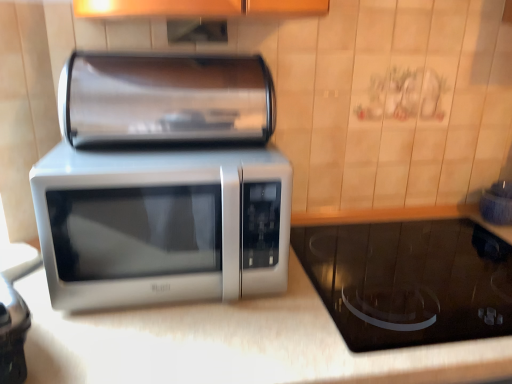
What do you see at coordinates (165, 99) in the screenshot?
I see `satin silver paper towel holder at upper center, placed as the second appliance when sorted from right to left` at bounding box center [165, 99].

What is the approximate height of black glass cooktop at lower right, which is the 1th appliance in right-to-left order?

black glass cooktop at lower right, which is the 1th appliance in right-to-left order, is 9.40 centimeters in height.

What is the approximate width of satin silver microwave at center?

satin silver microwave at center is 14.83 inches in width.

Locate an element on the screen. The image size is (512, 384). satin silver paper towel holder at upper center, placed as the second appliance when sorted from right to left is located at coordinates (165, 99).

Would you consider white glossy countertop at center to be distant from satin silver paper towel holder at upper center, positioned as the first appliance in left-to-right order?

No, white glossy countertop at center is in close proximity to satin silver paper towel holder at upper center, positioned as the first appliance in left-to-right order.

Does white glossy countertop at center have a smaller size compared to satin silver paper towel holder at upper center, positioned as the first appliance in left-to-right order?

No, white glossy countertop at center is not smaller than satin silver paper towel holder at upper center, positioned as the first appliance in left-to-right order.

Could you tell me if white glossy countertop at center is facing satin silver paper towel holder at upper center, which is the first appliance from top to bottom?

No, white glossy countertop at center is not facing towards satin silver paper towel holder at upper center, which is the first appliance from top to bottom.

Considering the relative sizes of white glossy countertop at center and satin silver paper towel holder at upper center, which is the first appliance from top to bottom, in the image provided, is white glossy countertop at center taller than satin silver paper towel holder at upper center, which is the first appliance from top to bottom,?

Correct, white glossy countertop at center is much taller as satin silver paper towel holder at upper center, which is the first appliance from top to bottom.

Identify the location of microwave oven below the satin silver paper towel holder at upper center, placed as the second appliance when sorted from right to left (from a real-world perspective). This screenshot has width=512, height=384. (161, 225).

From the picture: Is satin silver paper towel holder at upper center, the 2th appliance when ordered from bottom to top, oriented away from satin silver microwave at center?

That's not correct — satin silver paper towel holder at upper center, the 2th appliance when ordered from bottom to top, is not looking away from satin silver microwave at center.

From the image's perspective, is satin silver paper towel holder at upper center, positioned as the first appliance in left-to-right order, located above or below satin silver microwave at center?

From the image's perspective, satin silver paper towel holder at upper center, positioned as the first appliance in left-to-right order, appears above satin silver microwave at center.

From the picture: Which is more to the right, satin silver paper towel holder at upper center, the 2th appliance when ordered from bottom to top, or satin silver microwave at center?

satin silver microwave at center.

Is satin silver microwave at center far from satin silver paper towel holder at upper center, placed as the second appliance when sorted from right to left?

No, satin silver microwave at center is in close proximity to satin silver paper towel holder at upper center, placed as the second appliance when sorted from right to left.

Consider the image. Is satin silver microwave at center thinner than satin silver paper towel holder at upper center, which is the first appliance from top to bottom?

No, satin silver microwave at center is not thinner than satin silver paper towel holder at upper center, which is the first appliance from top to bottom.

Considering the relative sizes of satin silver microwave at center and satin silver paper towel holder at upper center, positioned as the first appliance in left-to-right order, in the image provided, is satin silver microwave at center taller than satin silver paper towel holder at upper center, positioned as the first appliance in left-to-right order,?

Yes.

Who is more distant, satin silver microwave at center or satin silver paper towel holder at upper center, positioned as the first appliance in left-to-right order?

satin silver paper towel holder at upper center, positioned as the first appliance in left-to-right order, is further from the camera.

Looking at this image, between satin silver paper towel holder at upper center, which is the first appliance from top to bottom, and black glass cooktop at lower right, which is counted as the second appliance, starting from the left, which one has smaller width?

With smaller width is satin silver paper towel holder at upper center, which is the first appliance from top to bottom.

From the image's perspective, is satin silver paper towel holder at upper center, positioned as the first appliance in left-to-right order, located above or below black glass cooktop at lower right, placed as the second appliance when sorted from top to bottom?

satin silver paper towel holder at upper center, positioned as the first appliance in left-to-right order, is situated higher than black glass cooktop at lower right, placed as the second appliance when sorted from top to bottom, in the image.

How many degrees apart are the facing directions of satin silver paper towel holder at upper center, which is the first appliance from top to bottom, and black glass cooktop at lower right, placed as the second appliance when sorted from top to bottom?

0.913 degrees separate the facing orientations of satin silver paper towel holder at upper center, which is the first appliance from top to bottom, and black glass cooktop at lower right, placed as the second appliance when sorted from top to bottom.

From the picture: Relative to black glass cooktop at lower right, the first appliance from the bottom, is satin silver paper towel holder at upper center, which is the first appliance from top to bottom, in front or behind?

In the image, satin silver paper towel holder at upper center, which is the first appliance from top to bottom, appears behind black glass cooktop at lower right, the first appliance from the bottom.

Is point (194, 260) in front of point (73, 322)?

No.

From the image's perspective, relative to white glossy countertop at center, is satin silver microwave at center above or below?

Clearly, from the image's perspective, satin silver microwave at center is above white glossy countertop at center.

Can you tell me how much satin silver microwave at center and white glossy countertop at center differ in facing direction?

The facing directions of satin silver microwave at center and white glossy countertop at center are 0.0853 degrees apart.

Considering the positions of objects satin silver microwave at center and black glass cooktop at lower right, placed as the second appliance when sorted from top to bottom, in the image provided, who is more to the left, satin silver microwave at center or black glass cooktop at lower right, placed as the second appliance when sorted from top to bottom,?

satin silver microwave at center.

Measure the distance from satin silver microwave at center to black glass cooktop at lower right, which is counted as the second appliance, starting from the left.

They are 14.63 inches apart.

Which is further, [138,188] or [485,235]?

Point [485,235]

What's the angular difference between satin silver microwave at center and black glass cooktop at lower right, placed as the second appliance when sorted from top to bottom,'s facing directions?

The angle between the facing direction of satin silver microwave at center and the facing direction of black glass cooktop at lower right, placed as the second appliance when sorted from top to bottom, is 0.0485 degrees.

Is black glass cooktop at lower right, which is the 1th appliance in right-to-left order, with white glossy countertop at center?

black glass cooktop at lower right, which is the 1th appliance in right-to-left order, and white glossy countertop at center are not in contact.

Considering the positions of objects black glass cooktop at lower right, placed as the second appliance when sorted from top to bottom, and white glossy countertop at center in the image provided, who is more to the right, black glass cooktop at lower right, placed as the second appliance when sorted from top to bottom, or white glossy countertop at center?

Positioned to the right is black glass cooktop at lower right, placed as the second appliance when sorted from top to bottom.

Consider the image. Which is more distant, (336,322) or (449,374)?

The point (336,322) is farther from the camera.

How many degrees apart are the facing directions of black glass cooktop at lower right, which is counted as the second appliance, starting from the left, and white glossy countertop at center?

They differ by 0.0368 degrees in their facing directions.

Image resolution: width=512 pixels, height=384 pixels. Identify the location of counter top on the right of the satin silver paper towel holder at upper center, the 2th appliance when ordered from bottom to top. (234, 344).

Find the location of a particular element. The image size is (512, 384). microwave oven that is in front of the satin silver paper towel holder at upper center, placed as the second appliance when sorted from right to left is located at coordinates (161, 225).

Which object lies further to the anchor point satin silver paper towel holder at upper center, positioned as the first appliance in left-to-right order, satin silver microwave at center or black glass cooktop at lower right, placed as the second appliance when sorted from top to bottom?

black glass cooktop at lower right, placed as the second appliance when sorted from top to bottom.

Which object lies further to the anchor point black glass cooktop at lower right, which is the 1th appliance in right-to-left order, satin silver paper towel holder at upper center, placed as the second appliance when sorted from right to left, or white glossy countertop at center?

satin silver paper towel holder at upper center, placed as the second appliance when sorted from right to left, lies further to black glass cooktop at lower right, which is the 1th appliance in right-to-left order, than the other object.

Estimate the real-world distances between objects in this image. Which object is closer to satin silver paper towel holder at upper center, positioned as the first appliance in left-to-right order, black glass cooktop at lower right, placed as the second appliance when sorted from top to bottom, or satin silver microwave at center?

Among the two, satin silver microwave at center is located nearer to satin silver paper towel holder at upper center, positioned as the first appliance in left-to-right order.

Looking at the image, which one is located further to white glossy countertop at center, satin silver paper towel holder at upper center, the 2th appliance when ordered from bottom to top, or black glass cooktop at lower right, the first appliance from the bottom?

Based on the image, satin silver paper towel holder at upper center, the 2th appliance when ordered from bottom to top, appears to be further to white glossy countertop at center.

Considering their positions, is satin silver microwave at center positioned closer to white glossy countertop at center than satin silver paper towel holder at upper center, placed as the second appliance when sorted from right to left?

The object closer to white glossy countertop at center is satin silver microwave at center.

Considering their positions, is white glossy countertop at center positioned further to black glass cooktop at lower right, which is the 1th appliance in right-to-left order, than satin silver paper towel holder at upper center, which is the first appliance from top to bottom?

The object further to black glass cooktop at lower right, which is the 1th appliance in right-to-left order, is satin silver paper towel holder at upper center, which is the first appliance from top to bottom.

Considering their positions, is white glossy countertop at center positioned closer to satin silver paper towel holder at upper center, positioned as the first appliance in left-to-right order, than satin silver microwave at center?

Among the two, satin silver microwave at center is located nearer to satin silver paper towel holder at upper center, positioned as the first appliance in left-to-right order.

Based on their spatial positions, is black glass cooktop at lower right, placed as the second appliance when sorted from top to bottom, or satin silver paper towel holder at upper center, positioned as the first appliance in left-to-right order, closer to satin silver microwave at center?

satin silver paper towel holder at upper center, positioned as the first appliance in left-to-right order, is closer to satin silver microwave at center.

Locate an element on the screen. microwave oven between satin silver paper towel holder at upper center, positioned as the first appliance in left-to-right order, and white glossy countertop at center vertically is located at coordinates click(x=161, y=225).

This screenshot has width=512, height=384. In order to click on microwave oven between satin silver paper towel holder at upper center, which is the first appliance from top to bottom, and black glass cooktop at lower right, placed as the second appliance when sorted from top to bottom, from left to right in this screenshot , I will do `click(161, 225)`.

This screenshot has height=384, width=512. What are the coordinates of `counter top located between satin silver microwave at center and black glass cooktop at lower right, which is the 1th appliance in right-to-left order, in the left-right direction` in the screenshot? It's located at (234, 344).

Where is `appliance between satin silver paper towel holder at upper center, which is the first appliance from top to bottom, and white glossy countertop at center vertically`? The image size is (512, 384). appliance between satin silver paper towel holder at upper center, which is the first appliance from top to bottom, and white glossy countertop at center vertically is located at coordinates (409, 281).